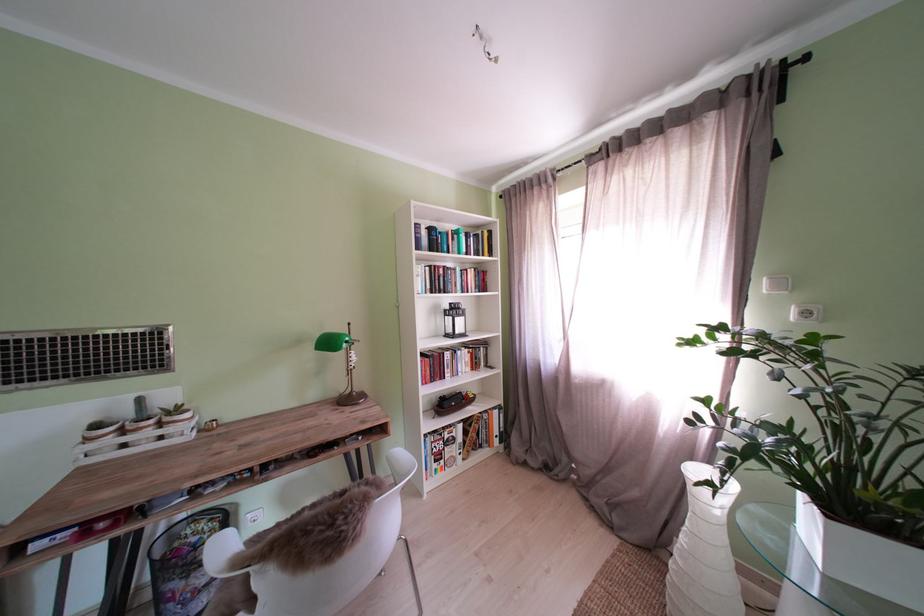
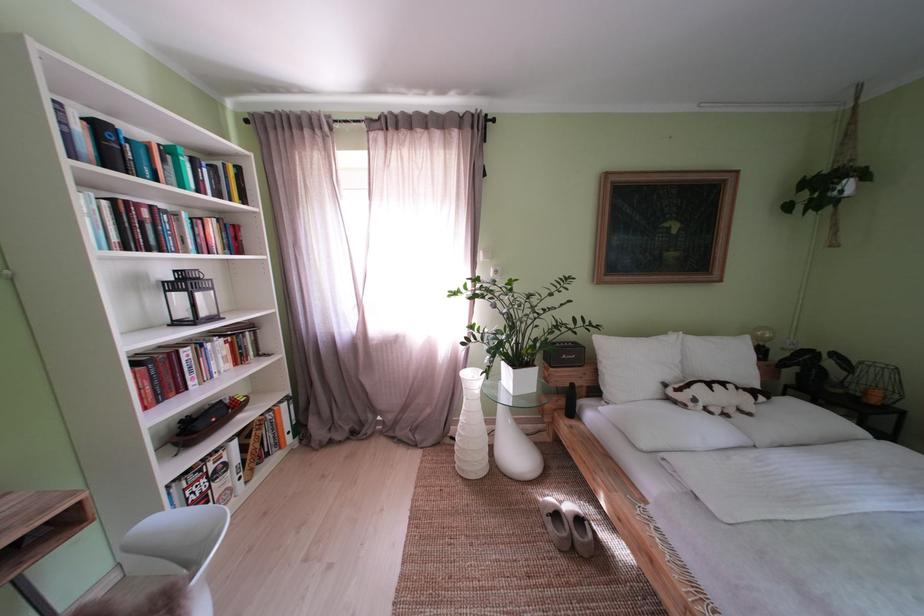
Find the pixel in the second image that matches (x=466, y=275) in the first image.

(188, 220)